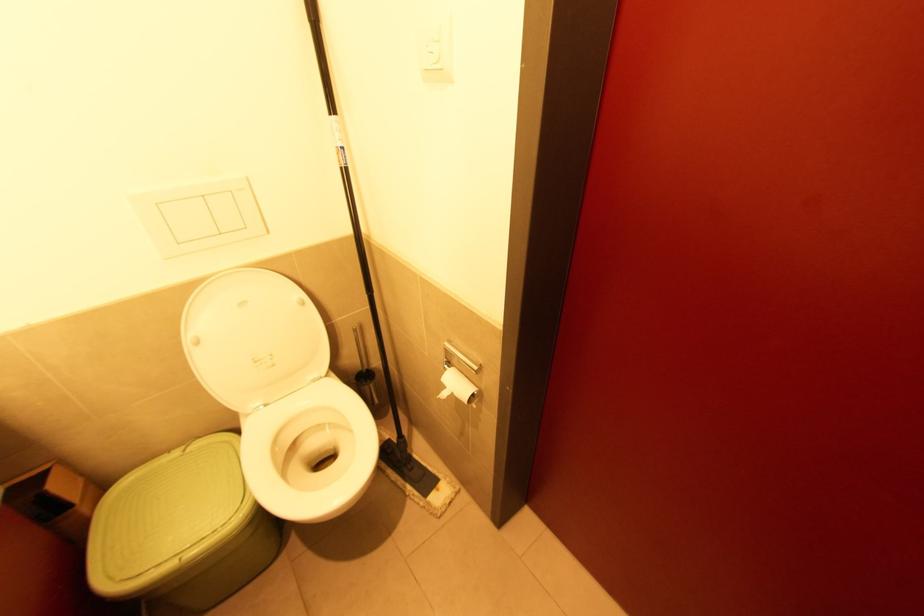
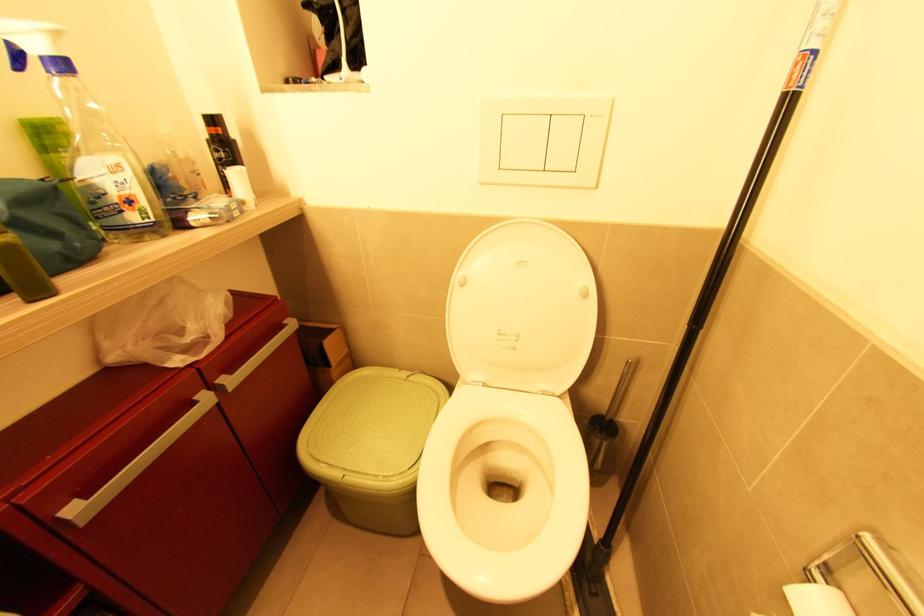
Question: The camera is either moving clockwise (left) or counter-clockwise (right) around the object. The first image is from the beginning of the video and the second image is from the end. Is the camera moving left or right when shooting the video?

Choices:
 (A) Left
 (B) Right

Answer: (B)